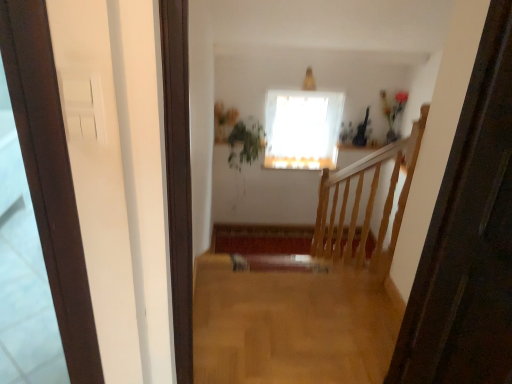
Measure the distance between light brown wood floor at center and camera.

A distance of 5.97 feet exists between light brown wood floor at center and camera.

What do you see at coordinates (245, 143) in the screenshot? This screenshot has height=384, width=512. I see `green leafy plant at upper center` at bounding box center [245, 143].

Image resolution: width=512 pixels, height=384 pixels. I want to click on light brown wood floor at center, so click(x=291, y=323).

Where is `plain on the right of the green leafy plant at upper center`? plain on the right of the green leafy plant at upper center is located at coordinates (291, 323).

Does light brown wood floor at center have a greater height compared to green leafy plant at upper center?

No, light brown wood floor at center is not taller than green leafy plant at upper center.

Based on the photo, based on their positions, is light brown wood floor at center located to the left or right of green leafy plant at upper center?

light brown wood floor at center is positioned on green leafy plant at upper center's right side.

From the image's perspective, which one is positioned lower, light brown wood floor at center or green leafy plant at upper center?

From the image's view, light brown wood floor at center is below.

From a real-world perspective, is light brown wood floor at center below white sheer curtain at upper center?

No.

Could you tell me if light brown wood floor at center is turned towards white sheer curtain at upper center?

No, light brown wood floor at center is not aimed at white sheer curtain at upper center.

In terms of width, does light brown wood floor at center look wider or thinner when compared to white sheer curtain at upper center?

light brown wood floor at center is wider than white sheer curtain at upper center.

Can you confirm if green leafy plant at upper center is positioned to the left of white sheer curtain at upper center?

Yes.

Who is taller, green leafy plant at upper center or white sheer curtain at upper center?

Standing taller between the two is white sheer curtain at upper center.

Between point (243, 163) and point (304, 152), which one is positioned in front?

Point (243, 163)

Consider the image. Is green leafy plant at upper center wider than light brown wood floor at center?

In fact, green leafy plant at upper center might be narrower than light brown wood floor at center.

What's the angular difference between green leafy plant at upper center and light brown wood floor at center's facing directions?

The angular difference between green leafy plant at upper center and light brown wood floor at center is 0.00674 degrees.

Consider the image. Who is smaller, green leafy plant at upper center or light brown wood floor at center?

With smaller size is light brown wood floor at center.

Locate an element on the screen. This screenshot has height=384, width=512. plain on the right of green leafy plant at upper center is located at coordinates (291, 323).

Which object is thinner, white sheer curtain at upper center or green leafy plant at upper center?

Thinner between the two is white sheer curtain at upper center.

Which is behind, point (271, 114) or point (244, 146)?

The point (271, 114) is farther from the camera.

Does white sheer curtain at upper center have a greater height compared to green leafy plant at upper center?

Yes, white sheer curtain at upper center is taller than green leafy plant at upper center.

From the image's perspective, relative to green leafy plant at upper center, is white sheer curtain at upper center above or below?

Clearly, from the image's perspective, white sheer curtain at upper center is above green leafy plant at upper center.

From a real-world perspective, is white sheer curtain at upper center physically above light brown wood floor at center?

No, from a real-world perspective, white sheer curtain at upper center is not over light brown wood floor at center

Would you say white sheer curtain at upper center is to the left or to the right of light brown wood floor at center in the picture?

From the image, it's evident that white sheer curtain at upper center is to the right of light brown wood floor at center.

Is white sheer curtain at upper center completely or partially outside of light brown wood floor at center?

white sheer curtain at upper center lies outside light brown wood floor at center's area.

Locate an element on the screen. plant behind the light brown wood floor at center is located at coordinates (245, 143).

At what (x,y) coordinates should I click in order to perform the action: click on window that is above the light brown wood floor at center (from the image's perspective). Please return your answer as a coordinate pair (x, y). The height and width of the screenshot is (384, 512). Looking at the image, I should click on (302, 129).

Based on their spatial positions, is light brown wood floor at center or white sheer curtain at upper center closer to green leafy plant at upper center?

white sheer curtain at upper center is positioned closer to the anchor green leafy plant at upper center.

Looking at the image, which one is located closer to white sheer curtain at upper center, light brown wood floor at center or green leafy plant at upper center?

Based on the image, green leafy plant at upper center appears to be nearer to white sheer curtain at upper center.

Which object lies further to the anchor point white sheer curtain at upper center, green leafy plant at upper center or light brown wood floor at center?

The object further to white sheer curtain at upper center is light brown wood floor at center.

Looking at this image, estimate the real-world distances between objects in this image. Which object is closer to green leafy plant at upper center, white sheer curtain at upper center or light brown wood floor at center?

white sheer curtain at upper center.

Estimate the real-world distances between objects in this image. Which object is closer to light brown wood floor at center, white sheer curtain at upper center or green leafy plant at upper center?

white sheer curtain at upper center is positioned closer to the anchor light brown wood floor at center.

When comparing their distances from light brown wood floor at center, does green leafy plant at upper center or white sheer curtain at upper center seem further?

Among the two, green leafy plant at upper center is located further to light brown wood floor at center.

Locate an element on the screen. plant positioned between light brown wood floor at center and white sheer curtain at upper center from near to far is located at coordinates (245, 143).